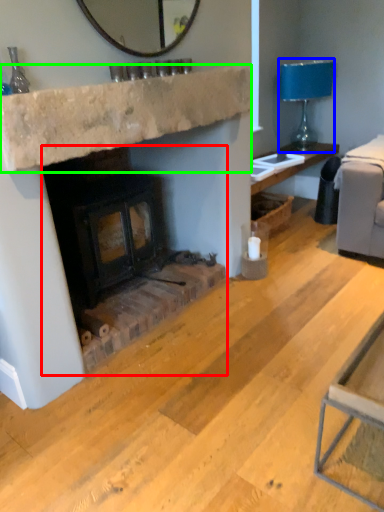
Question: Which is farther away from wood burning stove (highlighted by a red box)? lamp (highlighted by a blue box) or counter top (highlighted by a green box)?

Choices:
 (A) lamp
 (B) counter top

Answer: (A)